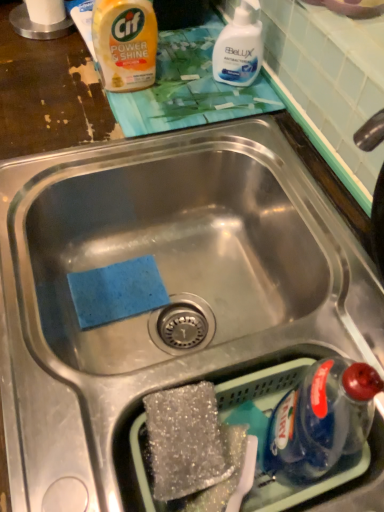
Locate an element on the screen. vacant space in front of white glossy liquid at upper center is located at coordinates (215, 106).